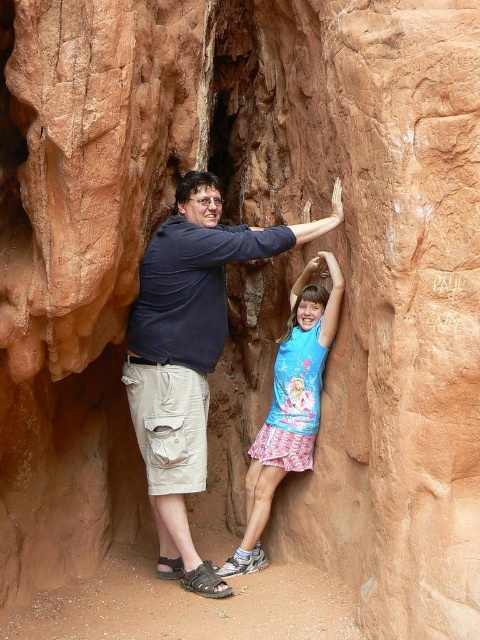
Question: Which point is closer to the camera?

Choices:
 (A) (172, 524)
 (B) (273, 440)

Answer: (A)

Question: Does matte blue shirt at center have a lesser width compared to blue printed shirt at center?

Choices:
 (A) no
 (B) yes

Answer: (A)

Question: Observing the image, what is the correct spatial positioning of matte blue shirt at center in reference to blue printed shirt at center?

Choices:
 (A) above
 (B) below

Answer: (A)

Question: Is matte blue shirt at center bigger than blue printed shirt at center?

Choices:
 (A) no
 (B) yes

Answer: (B)